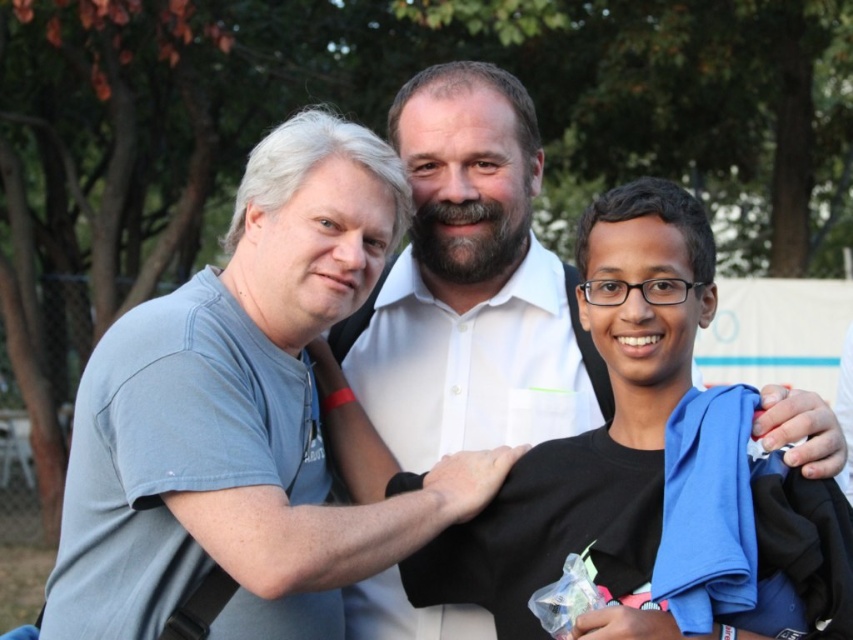
Question: Can you confirm if light blue cotton t-shirt at left is smaller than white shirt at center?

Choices:
 (A) yes
 (B) no

Answer: (B)

Question: Which point is closer to the camera?

Choices:
 (A) white shirt at center
 (B) light blue cotton t-shirt at left

Answer: (B)

Question: Can you confirm if light blue cotton t-shirt at left is positioned below white shirt at center?

Choices:
 (A) no
 (B) yes

Answer: (B)

Question: Can you confirm if light blue cotton t-shirt at left is bigger than white shirt at center?

Choices:
 (A) yes
 (B) no

Answer: (A)

Question: Which of the following is the farthest from the observer?

Choices:
 (A) light blue cotton t-shirt at left
 (B) white shirt at center

Answer: (B)